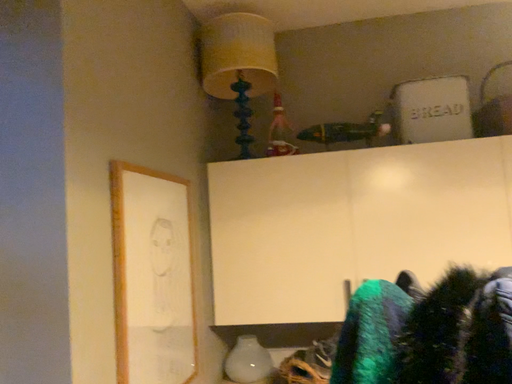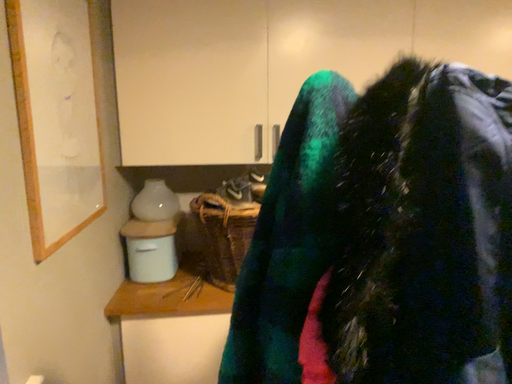
Question: How did the camera likely rotate when shooting the video?

Choices:
 (A) rotated downward
 (B) rotated upward

Answer: (A)